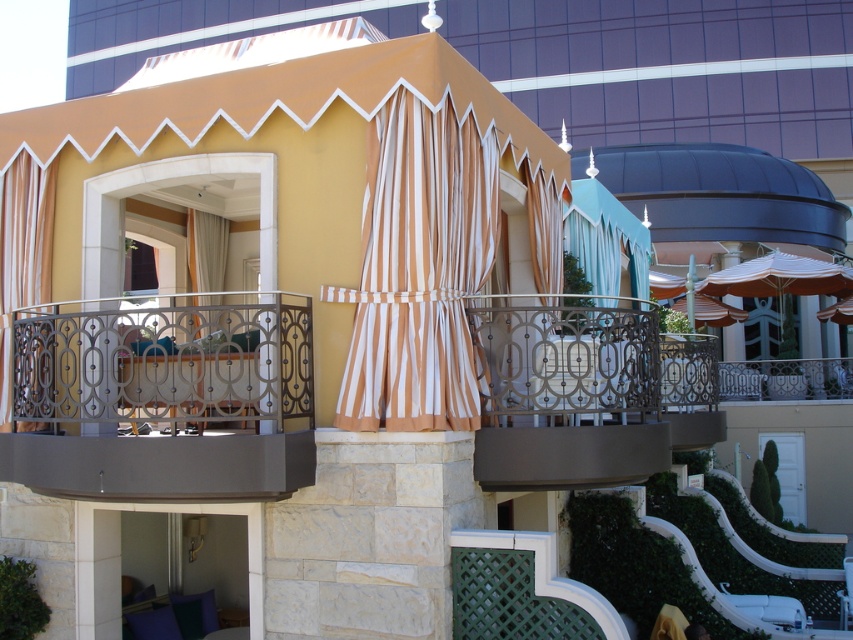
Question: Does metallic wrought iron at center appear over beige striped curtain at left?

Choices:
 (A) no
 (B) yes

Answer: (A)

Question: Which object is the closest to the metallic silver chair at lower right?

Choices:
 (A) white striped curtain at center
 (B) striped fabric curtain at center

Answer: (B)

Question: Considering the relative positions of brown and white striped curtain at center and metallic silver chair at lower right in the image provided, where is brown and white striped curtain at center located with respect to metallic silver chair at lower right?

Choices:
 (A) right
 (B) left

Answer: (B)

Question: Estimate the real-world distances between objects in this image. Which object is closer to the metallic wrought iron balcony at left?

Choices:
 (A) brown and white striped curtain at center
 (B) metallic wrought iron at center
 (C) beige striped curtain at left

Answer: (A)

Question: Which object is the farthest from the beige striped curtain at left?

Choices:
 (A) metallic wrought iron balcony at left
 (B) brown and white striped curtain at center

Answer: (B)

Question: Is metallic wrought iron balcony at left positioned at the back of white striped curtain at center?

Choices:
 (A) yes
 (B) no

Answer: (B)